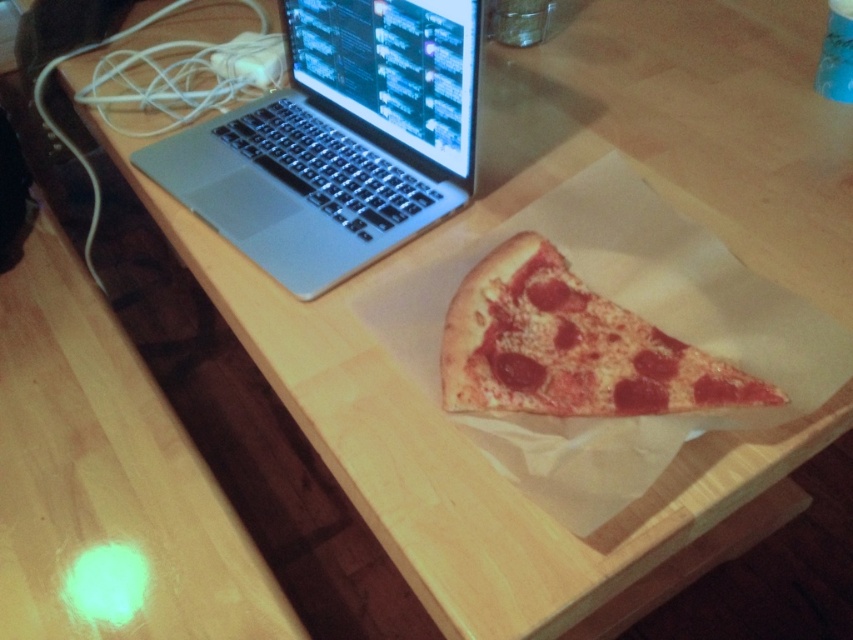
You are a person sitting at the desk and want to grab the cheesy pepperoni pizza at center. Is the silver metallic laptop at upper left blocking your direct line of sight to the pizza?

The silver metallic laptop at upper left is further to the viewer than the cheesy pepperoni pizza at center, so the laptop is closer to you and would block your direct line of sight to the pizza.

You are organizing items on a desk and need to place a new item between the silver metallic laptop at upper left and the cheesy pepperoni pizza at center. Is there enough space to place the item between them?

The silver metallic laptop at upper left is to the left of the cheesy pepperoni pizza at center, so there is space between them to place the new item.